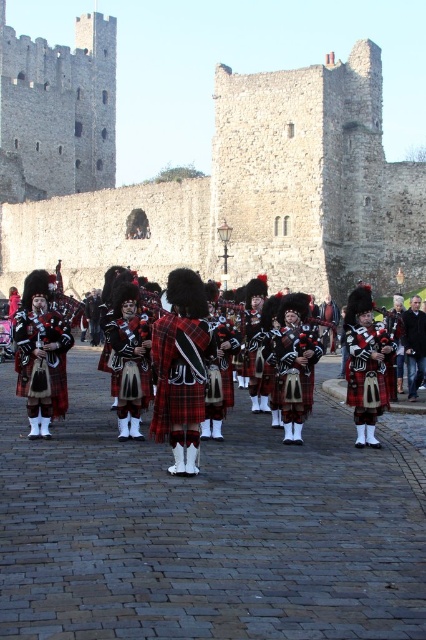
Which is below, stone wall at center or dark blue leather jacket at center?

dark blue leather jacket at center

Which is more to the right, stone wall at center or dark blue leather jacket at center?

dark blue leather jacket at center is more to the right.

Is point (253, 173) positioned before point (425, 316)?

That is False.

The image size is (426, 640). What are the coordinates of `stone wall at center` in the screenshot? It's located at (244, 193).

Between point (310, 477) and point (20, 368), which one is positioned in front?

Positioned in front is point (310, 477).

You are a GUI agent. You are given a task and a screenshot of the screen. Output one action in this format:
    pyautogui.click(x=<x>, y=<y>)
    Task: Click on the plaid fabric bagpipes at center
    
    Given the screenshot: What is the action you would take?
    pyautogui.click(x=201, y=452)

Does stone wall at center have a smaller size compared to plaid fabric bagpipes at center?

Incorrect, stone wall at center is not smaller in size than plaid fabric bagpipes at center.

Is stone wall at center taller than plaid fabric bagpipes at center?

Indeed, stone wall at center has a greater height compared to plaid fabric bagpipes at center.

Locate an element on the screen. Image resolution: width=426 pixels, height=640 pixels. stone wall at center is located at coordinates (244, 193).